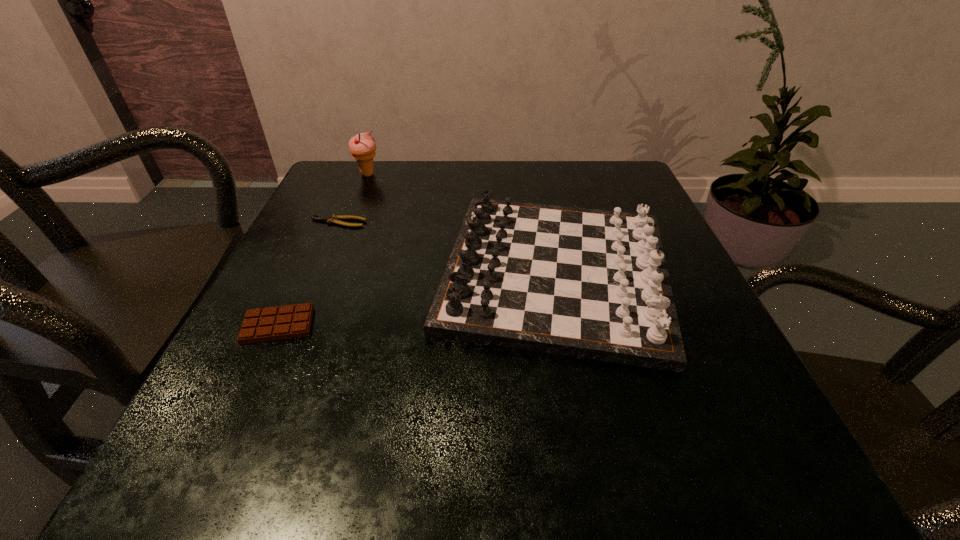
I want to click on free space between the pliers and the third tallest object, so click(308, 274).

This screenshot has width=960, height=540. I want to click on free point between the icecream and the shortest object, so click(352, 198).

At what (x,y) coordinates should I click in order to perform the action: click on free point between the icecream and the candy bar. Please return your answer as a coordinate pair (x, y). Image resolution: width=960 pixels, height=540 pixels. Looking at the image, I should click on (323, 250).

I want to click on vacant space in between the chessboard and the farthest object, so click(x=462, y=223).

You are a GUI agent. You are given a task and a screenshot of the screen. Output one action in this format:
    pyautogui.click(x=<x>, y=<y>)
    Task: Click on the free area in between the icecream and the second shortest object
    
    Given the screenshot: What is the action you would take?
    pyautogui.click(x=323, y=250)

Find the location of `object that ranks as the closest to the pliers`. object that ranks as the closest to the pliers is located at coordinates (586, 283).

Find the location of `object that stands as the second closest to the pliers`. object that stands as the second closest to the pliers is located at coordinates (362, 146).

Find the location of `vacant space that satisfies the following two spatial constraints: 1. on the front side of the third shortest object; 2. on the right side of the farthest object`. vacant space that satisfies the following two spatial constraints: 1. on the front side of the third shortest object; 2. on the right side of the farthest object is located at coordinates (328, 272).

You are a GUI agent. You are given a task and a screenshot of the screen. Output one action in this format:
    pyautogui.click(x=<x>, y=<y>)
    Task: Click on the free space that satisfies the following two spatial constraints: 1. on the back side of the shortest object; 2. on the left side of the third tallest object
    This screenshot has height=540, width=960.
    Given the screenshot: What is the action you would take?
    pyautogui.click(x=326, y=222)

Find the location of a particular element. blank space that satisfies the following two spatial constraints: 1. on the back side of the candy bar; 2. on the left side of the rightmost object is located at coordinates (303, 272).